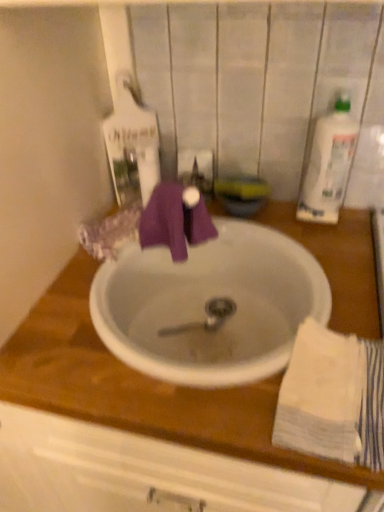
Question: Is white cotton towel at lower right oriented away from white ceramic sink at center?

Choices:
 (A) no
 (B) yes

Answer: (B)

Question: From a real-world perspective, is white cotton towel at lower right beneath white ceramic sink at center?

Choices:
 (A) yes
 (B) no

Answer: (B)

Question: From the image's perspective, is white cotton towel at lower right beneath white ceramic sink at center?

Choices:
 (A) yes
 (B) no

Answer: (A)

Question: Is white cotton towel at lower right behind white ceramic sink at center?

Choices:
 (A) no
 (B) yes

Answer: (A)

Question: From a real-world perspective, does white cotton towel at lower right stand above white ceramic sink at center?

Choices:
 (A) no
 (B) yes

Answer: (B)

Question: Is white cotton towel at lower right smaller than white ceramic sink at center?

Choices:
 (A) yes
 (B) no

Answer: (A)

Question: Are white plastic bottle at upper right and white cotton towel at lower right located far from each other?

Choices:
 (A) no
 (B) yes

Answer: (A)

Question: From a real-world perspective, is white plastic bottle at upper right physically above white cotton towel at lower right?

Choices:
 (A) yes
 (B) no

Answer: (A)

Question: Is white plastic bottle at upper right at the right side of white cotton towel at lower right?

Choices:
 (A) yes
 (B) no

Answer: (A)

Question: Considering the relative sizes of white plastic bottle at upper right and white cotton towel at lower right in the image provided, is white plastic bottle at upper right thinner than white cotton towel at lower right?

Choices:
 (A) yes
 (B) no

Answer: (A)

Question: Considering the relative positions of white plastic bottle at upper right and white cotton towel at lower right in the image provided, is white plastic bottle at upper right in front of white cotton towel at lower right?

Choices:
 (A) no
 (B) yes

Answer: (A)

Question: Is white plastic bottle at upper right looking in the opposite direction of white cotton towel at lower right?

Choices:
 (A) yes
 (B) no

Answer: (B)

Question: From the image's perspective, is white ceramic sink at center on top of white cotton towel at lower right?

Choices:
 (A) no
 (B) yes

Answer: (B)